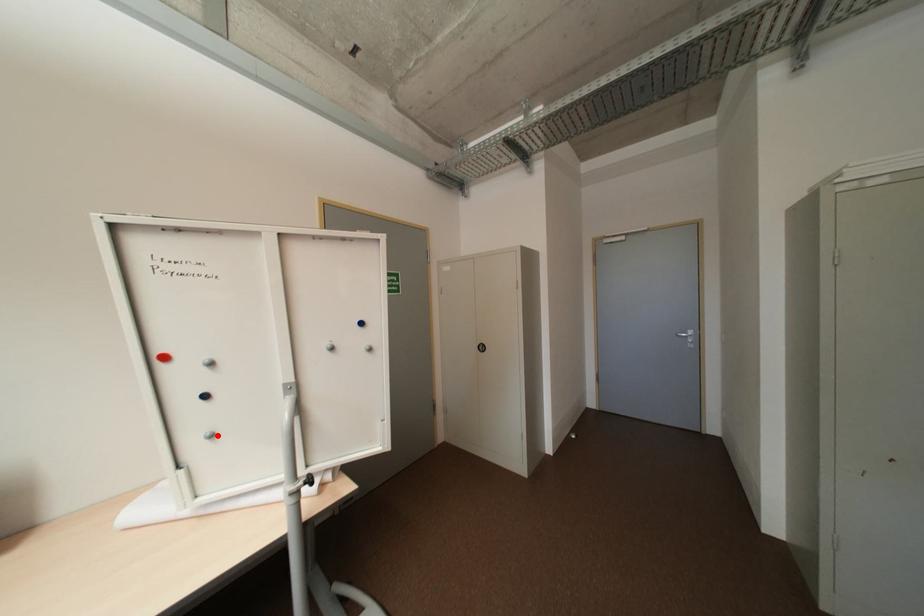
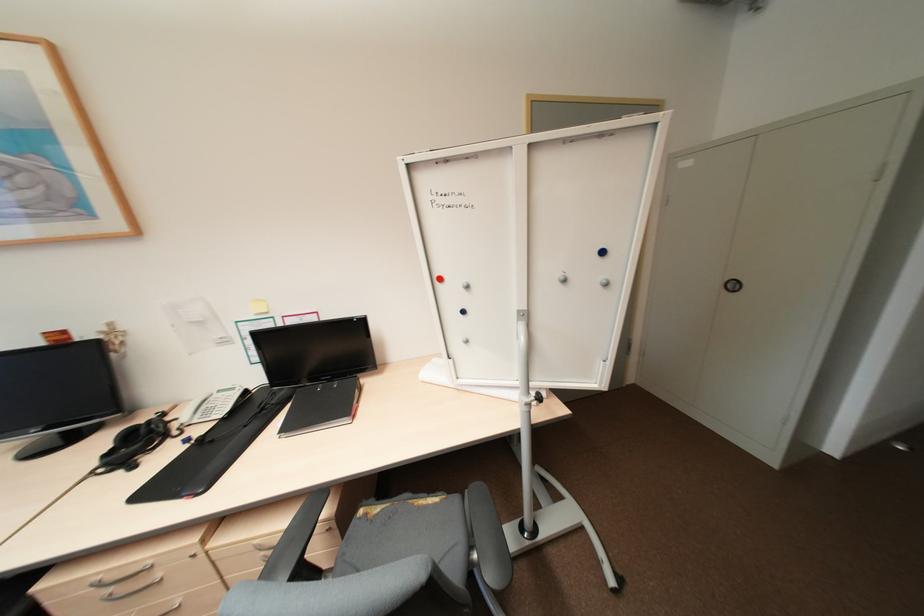
Locate, in the second image, the point that corresponds to the highlighted location in the first image.

(472, 341)